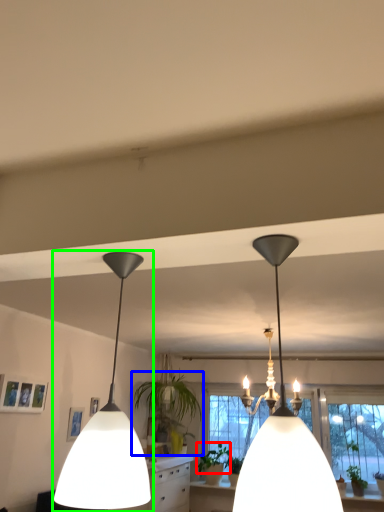
Question: Based on their relative distances, which object is nearer to plant (highlighted by a red box)? Choose from houseplant (highlighted by a blue box) and lamp (highlighted by a green box).

Choices:
 (A) houseplant
 (B) lamp

Answer: (A)